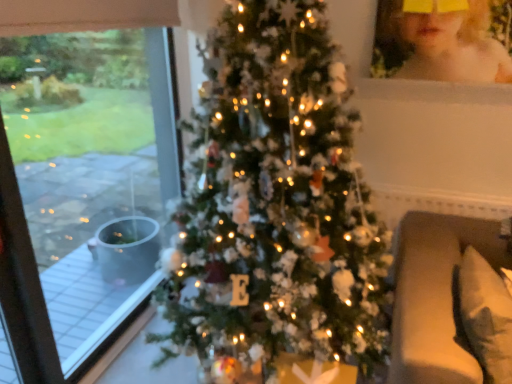
Locate an element on the screen. green matte christmas tree at center is located at coordinates (275, 201).

The image size is (512, 384). What do you see at coordinates (275, 201) in the screenshot?
I see `green matte christmas tree at center` at bounding box center [275, 201].

Measure the distance between beige fabric couch at right and camera.

beige fabric couch at right and camera are 1.25 meters apart.

You are a GUI agent. You are given a task and a screenshot of the screen. Output one action in this format:
    pyautogui.click(x=<x>, y=<y>)
    Task: Click on the blonde hair at upper right
    Image resolution: width=512 pixels, height=384 pixels.
    Given the screenshot: What is the action you would take?
    pyautogui.click(x=440, y=41)

Identify the location of white soft pillow at lower right. This screenshot has height=384, width=512. (486, 315).

This screenshot has height=384, width=512. I want to click on green matte christmas tree at center, so click(x=275, y=201).

Who is bigger, white soft pillow at lower right or green matte christmas tree at center?

green matte christmas tree at center is bigger.

Considering the sizes of objects white soft pillow at lower right and green matte christmas tree at center in the image provided, who is shorter, white soft pillow at lower right or green matte christmas tree at center?

white soft pillow at lower right is shorter.

Visually, is white soft pillow at lower right positioned to the left or to the right of green matte christmas tree at center?

From the image, it's evident that white soft pillow at lower right is to the right of green matte christmas tree at center.

Consider the image. Is beige fabric couch at right not near white soft pillow at lower right?

beige fabric couch at right is near white soft pillow at lower right, not far away.

Is beige fabric couch at right further to the viewer compared to white soft pillow at lower right?

That is False.

Identify the location of couch that is on the left side of white soft pillow at lower right. The height and width of the screenshot is (384, 512). (451, 302).

How different are the orientations of beige fabric couch at right and white soft pillow at lower right in degrees?

They differ by 92.2 degrees in their facing directions.

From a real-world perspective, which is physically below, blonde hair at upper right or green matte christmas tree at center?

From a 3D spatial view, green matte christmas tree at center is below.

In the image, is blonde hair at upper right positioned in front of or behind green matte christmas tree at center?

blonde hair at upper right is behind green matte christmas tree at center.

Is green matte christmas tree at center located within blonde hair at upper right?

No.

Does beige fabric couch at right come behind green matte christmas tree at center?

Yes, the depth of beige fabric couch at right is greater than that of green matte christmas tree at center.

Looking at this image, are beige fabric couch at right and green matte christmas tree at center far apart?

beige fabric couch at right is near green matte christmas tree at center, not far away.

Locate an element on the screen. christmas tree that is on the left side of beige fabric couch at right is located at coordinates pyautogui.click(x=275, y=201).

Between white soft pillow at lower right and transparent glass window at left, which one has less height?

white soft pillow at lower right.

The height and width of the screenshot is (384, 512). What are the coordinates of `pillow located below the transparent glass window at left (from the image's perspective)` in the screenshot? It's located at (486, 315).

From the image's perspective, is white soft pillow at lower right located above or below transparent glass window at left?

Based on their image positions, white soft pillow at lower right is located beneath transparent glass window at left.

Considering the positions of point (465, 264) and point (32, 110), is point (465, 264) closer or farther from the camera than point (32, 110)?

Clearly, point (465, 264) is closer to the camera than point (32, 110).

Does white soft pillow at lower right have a greater height compared to beige fabric couch at right?

No, white soft pillow at lower right is not taller than beige fabric couch at right.

Is point (501, 330) closer or farther from the camera than point (420, 258)?

Clearly, point (501, 330) is closer to the camera than point (420, 258).

Looking at the image, does white soft pillow at lower right seem bigger or smaller compared to beige fabric couch at right?

white soft pillow at lower right is smaller than beige fabric couch at right.

Considering the relative positions of blonde hair at upper right and white soft pillow at lower right in the image provided, is blonde hair at upper right in front of white soft pillow at lower right?

No, blonde hair at upper right is further to the viewer.

How distant is blonde hair at upper right from white soft pillow at lower right?

blonde hair at upper right and white soft pillow at lower right are 3.49 feet apart from each other.

Which of these two, blonde hair at upper right or white soft pillow at lower right, stands shorter?

With less height is blonde hair at upper right.

The width and height of the screenshot is (512, 384). In order to click on pillow below the green matte christmas tree at center (from a real-world perspective) in this screenshot , I will do `click(486, 315)`.

Locate an element on the screen. The height and width of the screenshot is (384, 512). pillow that is above the beige fabric couch at right (from the image's perspective) is located at coordinates (486, 315).

When comparing their distances from white soft pillow at lower right, does blonde hair at upper right or transparent glass window at left seem closer?

blonde hair at upper right is positioned closer to the anchor white soft pillow at lower right.

From the image, which object appears to be farther from transparent glass window at left, beige fabric couch at right or white soft pillow at lower right?

white soft pillow at lower right lies further to transparent glass window at left than the other object.

In the scene shown: From the image, which object appears to be farther from blonde hair at upper right, transparent glass window at left or white soft pillow at lower right?

transparent glass window at left is further to blonde hair at upper right.

Looking at the image, which one is located further to beige fabric couch at right, white soft pillow at lower right or transparent glass window at left?

Among the two, transparent glass window at left is located further to beige fabric couch at right.

Considering their positions, is blonde hair at upper right positioned further to green matte christmas tree at center than white soft pillow at lower right?

blonde hair at upper right lies further to green matte christmas tree at center than the other object.

When comparing their distances from blonde hair at upper right, does beige fabric couch at right or transparent glass window at left seem further?

Among the two, transparent glass window at left is located further to blonde hair at upper right.

Considering their positions, is blonde hair at upper right positioned closer to beige fabric couch at right than transparent glass window at left?

blonde hair at upper right lies closer to beige fabric couch at right than the other object.

Looking at the image, which one is located further to transparent glass window at left, blonde hair at upper right or beige fabric couch at right?

beige fabric couch at right.

Find the location of a particular element. This screenshot has width=512, height=384. toddler between transparent glass window at left and beige fabric couch at right from left to right is located at coordinates (440, 41).

Find the location of a particular element. The width and height of the screenshot is (512, 384). pillow between blonde hair at upper right and beige fabric couch at right vertically is located at coordinates (486, 315).

The height and width of the screenshot is (384, 512). In order to click on christmas tree between transparent glass window at left and blonde hair at upper right in the horizontal direction in this screenshot , I will do `click(275, 201)`.

Where is `christmas tree situated between transparent glass window at left and beige fabric couch at right from left to right`? Image resolution: width=512 pixels, height=384 pixels. christmas tree situated between transparent glass window at left and beige fabric couch at right from left to right is located at coordinates (275, 201).